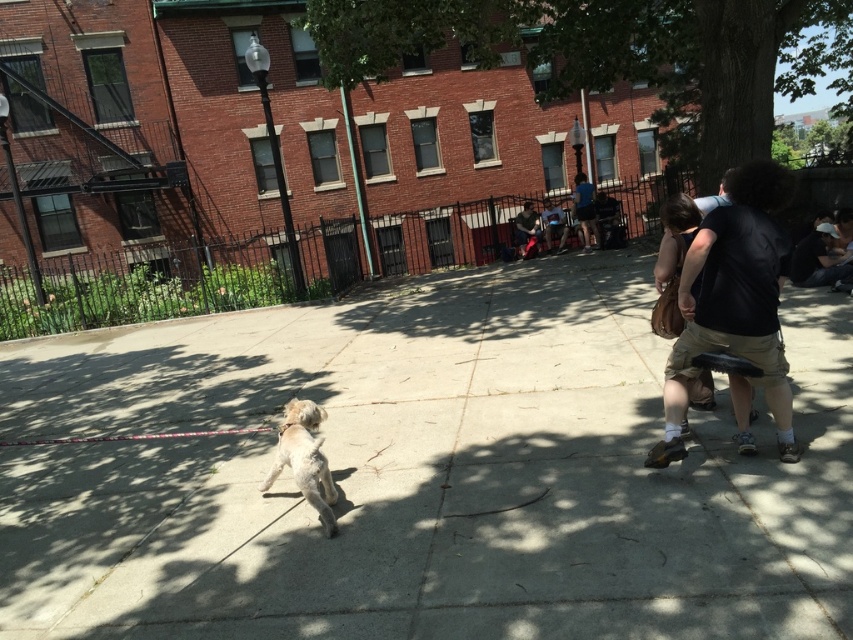
Consider the image. You are standing in the park and want to place a 3.5 meters long banner from your current position to the point marked as point (190, 609). Is the distance sufficient for the banner?

The point (190, 609) is 3.25 meters away from the viewer. Since the banner is 3.5 meters long, the distance is insufficient as it is shorter than the banner.

You are standing on the smooth concrete pavement at center and want to move towards the light brown fur at lower left. Which direction should you walk?

You should walk to the right because the smooth concrete pavement at center is positioned on the left side of light brown fur at lower left.

You are standing in the park and see a person wearing a blue fabric shirt at upper right and dark blue jeans at center. Which piece of clothing is higher up in the image?

The blue fabric shirt at upper right is taller than dark blue jeans at center in the image.